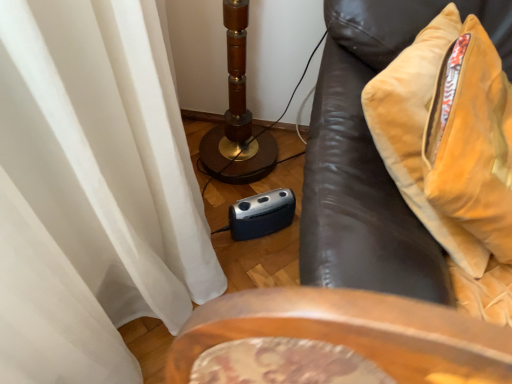
What is the approximate height of velvet yellow pillow at right?

21.71 inches.

This screenshot has width=512, height=384. Describe the element at coordinates (418, 132) in the screenshot. I see `velvet yellow pillow at right` at that location.

I want to click on velvet yellow pillow at right, so click(x=418, y=132).

What is the approximate width of velvet yellow pillow at right?

20.01 centimeters.

Where is `velvet brown sofa at right`? velvet brown sofa at right is located at coordinates (359, 193).

What do you see at coordinates (359, 193) in the screenshot? I see `velvet brown sofa at right` at bounding box center [359, 193].

Where is `velvet yellow pillow at right`? Image resolution: width=512 pixels, height=384 pixels. velvet yellow pillow at right is located at coordinates (418, 132).

Visually, is velvet brown sofa at right positioned to the left or to the right of velvet yellow pillow at right?

From the image, it's evident that velvet brown sofa at right is to the right of velvet yellow pillow at right.

Does velvet brown sofa at right lie behind velvet yellow pillow at right?

No, velvet brown sofa at right is in front of velvet yellow pillow at right.

Considering the positions of points (360, 129) and (407, 113), is point (360, 129) closer to camera compared to point (407, 113)?

That is False.

From the image's perspective, is velvet brown sofa at right positioned above or below velvet yellow pillow at right?

Clearly, from the image's perspective, velvet brown sofa at right is below velvet yellow pillow at right.

From a real-world perspective, is velvet brown sofa at right above or below velvet yellow pillow at right?

Clearly, from a real-world perspective, velvet brown sofa at right is below velvet yellow pillow at right.

In terms of width, does velvet brown sofa at right look wider or thinner when compared to velvet yellow pillow at right?

velvet brown sofa at right is wider than velvet yellow pillow at right.

Who is taller, velvet brown sofa at right or velvet yellow pillow at right?

Standing taller between the two is velvet brown sofa at right.

Can you confirm if velvet brown sofa at right is bigger than velvet yellow pillow at right?

Indeed, velvet brown sofa at right has a larger size compared to velvet yellow pillow at right.

Would you say velvet yellow pillow at right is part of velvet brown sofa at right's contents?

Yes, velvet yellow pillow at right is surrounded by velvet brown sofa at right.

Is velvet brown sofa at right with velvet yellow pillow at right?

Yes, velvet brown sofa at right is right next to velvet yellow pillow at right and making contact.

Is velvet brown sofa at right turned away from velvet yellow pillow at right?

Yes, velvet yellow pillow at right is at the back of velvet brown sofa at right.

In order to click on throw pillow that is behind the velvet brown sofa at right in this screenshot , I will do `click(418, 132)`.

Is velvet yellow pillow at right to the left or to the right of velvet brown sofa at right in the image?

From the image, it's evident that velvet yellow pillow at right is to the left of velvet brown sofa at right.

Is velvet yellow pillow at right positioned behind velvet brown sofa at right?

Yes, velvet yellow pillow at right is behind velvet brown sofa at right.

Is point (450, 253) closer to viewer compared to point (362, 258)?

No, (450, 253) is further to viewer.

From the image's perspective, is velvet yellow pillow at right above or below velvet brown sofa at right?

velvet yellow pillow at right is situated higher than velvet brown sofa at right in the image.

In the scene shown: From a real-world perspective, who is located lower, velvet yellow pillow at right or velvet brown sofa at right?

velvet brown sofa at right, from a real-world perspective.

Is velvet yellow pillow at right wider than velvet brown sofa at right?

In fact, velvet yellow pillow at right might be narrower than velvet brown sofa at right.

Considering the relative sizes of velvet yellow pillow at right and velvet brown sofa at right in the image provided, is velvet yellow pillow at right taller than velvet brown sofa at right?

In fact, velvet yellow pillow at right may be shorter than velvet brown sofa at right.

Consider the image. Can you confirm if velvet yellow pillow at right is smaller than velvet brown sofa at right?

Yes, velvet yellow pillow at right is smaller than velvet brown sofa at right.

Is velvet yellow pillow at right located outside velvet brown sofa at right?

That's incorrect, velvet yellow pillow at right is not completely outside velvet brown sofa at right.

Is velvet yellow pillow at right far from velvet brown sofa at right?

That's not correct — velvet yellow pillow at right is a little close to velvet brown sofa at right.

Could you tell me if velvet yellow pillow at right is facing velvet brown sofa at right?

Yes.

How many degrees apart are the facing directions of velvet yellow pillow at right and velvet brown sofa at right?

There is a 63.7-degree angle between the facing directions of velvet yellow pillow at right and velvet brown sofa at right.

How much distance is there between velvet yellow pillow at right and velvet brown sofa at right?

velvet yellow pillow at right is 3.71 inches from velvet brown sofa at right.

What are the coordinates of `throw pillow that appears above the velvet brown sofa at right (from a real-world perspective)` in the screenshot? It's located at (418, 132).

You are a GUI agent. You are given a task and a screenshot of the screen. Output one action in this format:
    pyautogui.click(x=<x>, y=<y>)
    Task: Click on the throw pillow behind the velvet brown sofa at right
    The image size is (512, 384).
    Given the screenshot: What is the action you would take?
    pyautogui.click(x=418, y=132)

This screenshot has height=384, width=512. I want to click on throw pillow above the velvet brown sofa at right (from the image's perspective), so click(418, 132).